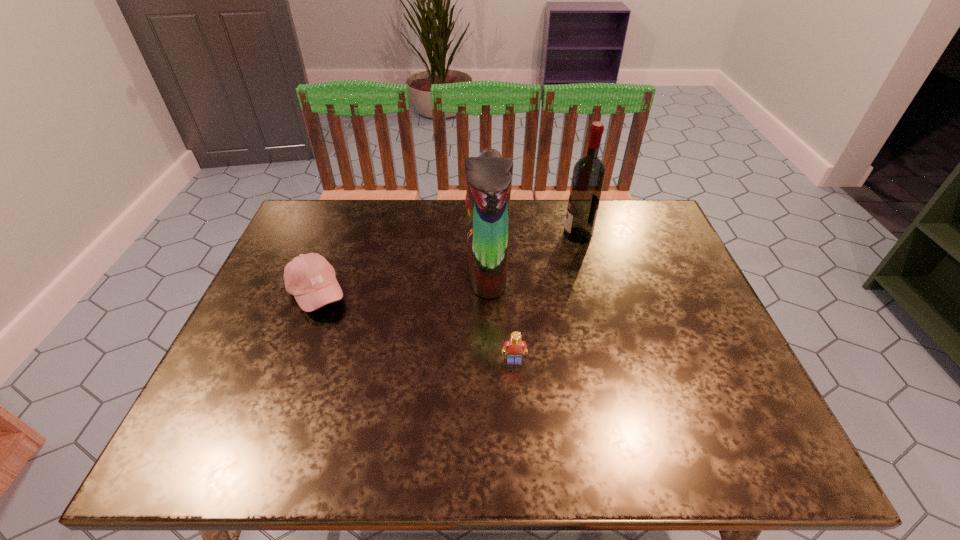
Image resolution: width=960 pixels, height=540 pixels. In order to click on vacant space located 0.370m on the front-facing side of the baseball cap in this screenshot , I will do `click(492, 293)`.

Image resolution: width=960 pixels, height=540 pixels. What are the coordinates of `free space located 0.060m on the front-facing side of the Lego` in the screenshot? It's located at (516, 388).

Find the location of a particular element. This screenshot has width=960, height=540. alcohol that is at the far edge is located at coordinates (588, 176).

Find the location of a particular element. This screenshot has width=960, height=540. parrot that is at the far edge is located at coordinates (489, 176).

Locate an element on the screen. The width and height of the screenshot is (960, 540). object that is at the left edge is located at coordinates (310, 278).

Where is `blank space at the far edge`? Image resolution: width=960 pixels, height=540 pixels. blank space at the far edge is located at coordinates (417, 236).

In the image, there is a desktop. In order to click on blank space at the near edge in this screenshot , I will do `click(350, 425)`.

In the image, there is a desktop. At what (x,y) coordinates should I click in order to perform the action: click on vacant space at the left edge. Please return your answer as a coordinate pair (x, y). Looking at the image, I should click on (225, 410).

This screenshot has width=960, height=540. In the image, there is a desktop. In order to click on blank space at the right edge in this screenshot , I will do `click(709, 336)`.

The width and height of the screenshot is (960, 540). Find the location of `free region at the near right corner of the desktop`. free region at the near right corner of the desktop is located at coordinates (778, 446).